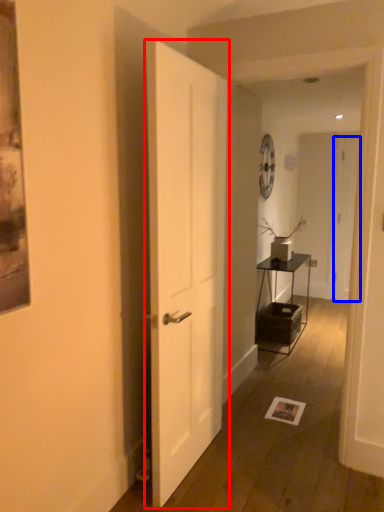
Question: Among these objects, which one is nearest to the camera, door (highlighted by a red box) or door (highlighted by a blue box)?

Choices:
 (A) door
 (B) door

Answer: (A)